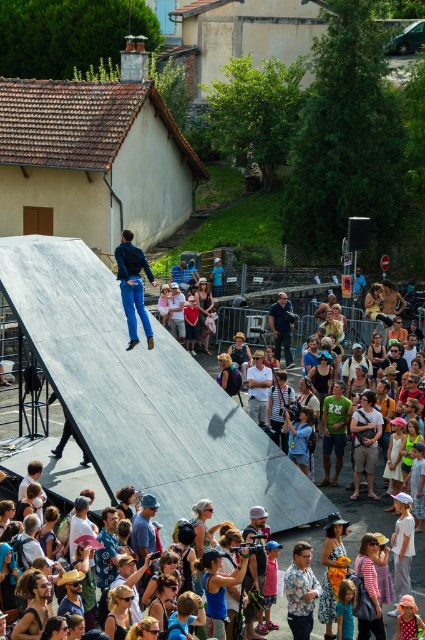
Question: Which object is farther from the camera taking this photo?

Choices:
 (A) denim pants at center
 (B) smooth gray ramp at center
 (C) khaki cotton shorts at center
 (D) blue fabric tank top at center

Answer: (C)

Question: Which of the following is the closest to the observer?

Choices:
 (A) khaki cotton shorts at center
 (B) green jersey at center
 (C) smooth gray ramp at center

Answer: (C)

Question: Can you confirm if denim pants at center is positioned to the right of dark blue shirt at center?

Choices:
 (A) yes
 (B) no

Answer: (B)

Question: Which object is farther from the camera taking this photo?

Choices:
 (A) smooth gray ramp at center
 (B) blue fabric tank top at center
 (C) khaki cotton shorts at center
 (D) dark blue shirt at center

Answer: (D)

Question: Is blue fabric tank top at center above denim shorts at center?

Choices:
 (A) yes
 (B) no

Answer: (B)

Question: In this image, where is floral shirt at lower center located relative to blue fabric tank top at center?

Choices:
 (A) below
 (B) above

Answer: (A)